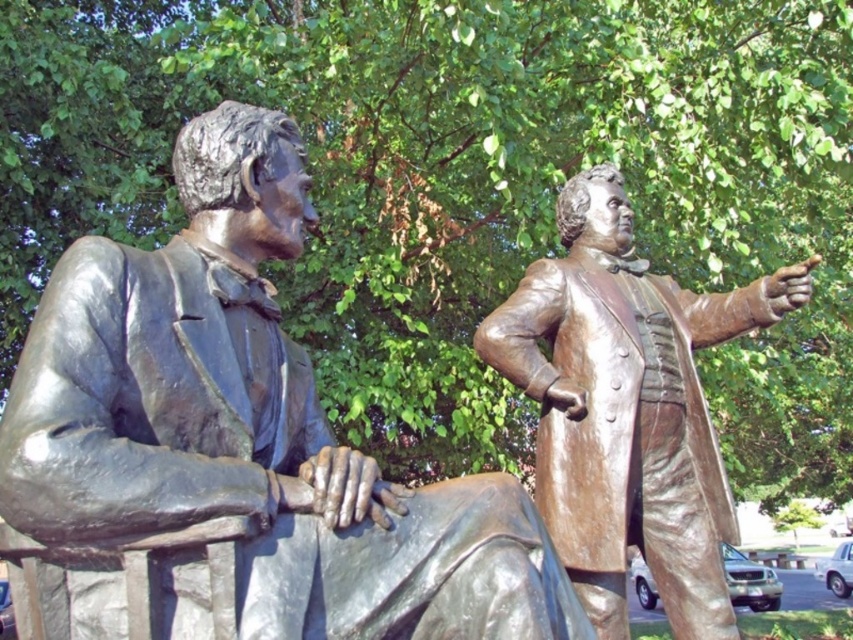
Question: Which point is farther to the camera?

Choices:
 (A) (148, 520)
 (B) (550, 483)

Answer: (B)

Question: Which point is closer to the camera taking this photo?

Choices:
 (A) (282, 630)
 (B) (672, 545)

Answer: (A)

Question: Does bronze statue at left appear under bronze statue at right?

Choices:
 (A) yes
 (B) no

Answer: (A)

Question: Which object appears closest to the camera in this image?

Choices:
 (A) bronze statue at left
 (B) bronze statue at right

Answer: (A)

Question: Can you confirm if bronze statue at left is positioned above bronze statue at right?

Choices:
 (A) yes
 (B) no

Answer: (B)

Question: Observing the image, what is the correct spatial positioning of bronze statue at left in reference to bronze statue at right?

Choices:
 (A) above
 (B) below

Answer: (B)